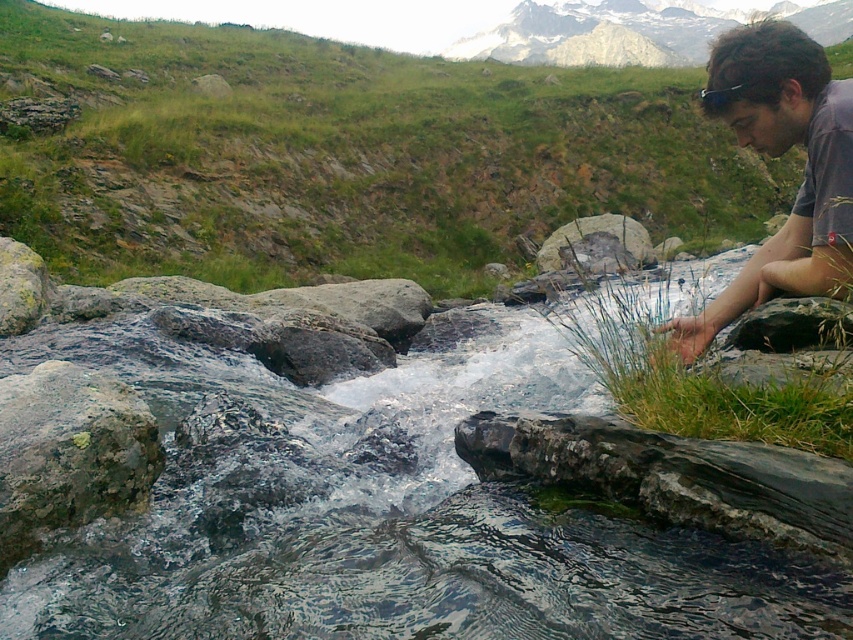
Find the location of `clear water at center`. clear water at center is located at coordinates (331, 484).

Measure the distance between point [436,374] and camera.

Point [436,374] and camera are 27.21 feet apart.

Where is `clear water at center`? clear water at center is located at coordinates (331, 484).

Does clear water at center come behind dark gray t-shirt at right?

No, it is not.

Is point (596, 582) positioned in front of point (849, 188)?

Yes, it is in front of point (849, 188).

Describe the element at coordinates (331, 484) in the screenshot. The image size is (853, 640). I see `clear water at center` at that location.

Locate an element on the screen. The image size is (853, 640). clear water at center is located at coordinates (331, 484).

Is green grassy hillside at upper left thinner than green grass at right?

In fact, green grassy hillside at upper left might be wider than green grass at right.

Is green grassy hillside at upper left in front of green grass at right?

No.

Which is in front, point (315, 168) or point (848, 308)?

Point (848, 308) is more forward.

This screenshot has height=640, width=853. Identify the location of green grassy hillside at upper left. (344, 156).